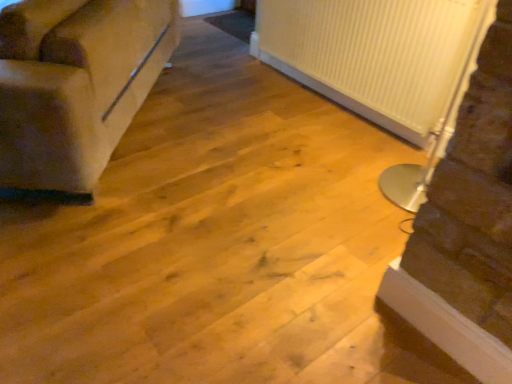
The width and height of the screenshot is (512, 384). Identify the location of white ribbed radiator at upper right. (372, 54).

This screenshot has height=384, width=512. Describe the element at coordinates (372, 54) in the screenshot. I see `white ribbed radiator at upper right` at that location.

The image size is (512, 384). I want to click on white ribbed radiator at right, so click(x=467, y=227).

Is white ribbed radiator at upper right behind suede-like beige couch at left?

Yes, white ribbed radiator at upper right is further from the camera.

Locate an element on the screen. This screenshot has height=384, width=512. radiator behind the suede-like beige couch at left is located at coordinates (372, 54).

Are white ribbed radiator at upper right and suede-like beige couch at left located far from each other?

Yes, white ribbed radiator at upper right and suede-like beige couch at left are located far from each other.

In terms of size, does white ribbed radiator at right appear bigger or smaller than white ribbed radiator at upper right?

Clearly, white ribbed radiator at right is larger in size than white ribbed radiator at upper right.

Considering the sizes of objects white ribbed radiator at right and white ribbed radiator at upper right in the image provided, who is shorter, white ribbed radiator at right or white ribbed radiator at upper right?

Standing shorter between the two is white ribbed radiator at upper right.

Would you say white ribbed radiator at right contains white ribbed radiator at upper right?

Actually, white ribbed radiator at upper right is outside white ribbed radiator at right.

Identify the location of stairwell that appears in front of the white ribbed radiator at upper right. The width and height of the screenshot is (512, 384). (467, 227).

From the image's perspective, is white ribbed radiator at right positioned above or below suede-like beige couch at left?

Clearly, from the image's perspective, white ribbed radiator at right is below suede-like beige couch at left.

Based on their positions, is white ribbed radiator at right located to the left or right of suede-like beige couch at left?

white ribbed radiator at right is positioned on suede-like beige couch at left's right side.

How different are the orientations of white ribbed radiator at right and suede-like beige couch at left in degrees?

The angular difference between white ribbed radiator at right and suede-like beige couch at left is 42.1 degrees.

In terms of size, does white ribbed radiator at right appear bigger or smaller than suede-like beige couch at left?

In the image, white ribbed radiator at right appears to be smaller than suede-like beige couch at left.

Can you confirm if suede-like beige couch at left is bigger than white ribbed radiator at right?

Correct, suede-like beige couch at left is larger in size than white ribbed radiator at right.

Is suede-like beige couch at left oriented away from white ribbed radiator at right?

Yes, white ribbed radiator at right is at the back of suede-like beige couch at left.

From the picture: From a real-world perspective, is suede-like beige couch at left physically below white ribbed radiator at right?

Yes, from a real-world perspective, suede-like beige couch at left is under white ribbed radiator at right.

In the scene shown: Does suede-like beige couch at left contain white ribbed radiator at upper right?

No, white ribbed radiator at upper right is not surrounded by suede-like beige couch at left.

Is suede-like beige couch at left next to white ribbed radiator at upper right and touching it?

No, suede-like beige couch at left is not making contact with white ribbed radiator at upper right.

Does suede-like beige couch at left have a smaller size compared to white ribbed radiator at upper right?

Actually, suede-like beige couch at left might be larger than white ribbed radiator at upper right.

Which is behind, suede-like beige couch at left or white ribbed radiator at upper right?

white ribbed radiator at upper right is behind.

You are a GUI agent. You are given a task and a screenshot of the screen. Output one action in this format:
    pyautogui.click(x=<x>, y=<y>)
    Task: Click on the radiator behind the white ribbed radiator at right
    
    Given the screenshot: What is the action you would take?
    pyautogui.click(x=372, y=54)

Does white ribbed radiator at upper right appear on the right side of white ribbed radiator at right?

Incorrect, white ribbed radiator at upper right is not on the right side of white ribbed radiator at right.

How different are the orientations of white ribbed radiator at upper right and white ribbed radiator at right in degrees?

white ribbed radiator at upper right and white ribbed radiator at right are facing 0.203 degrees away from each other.

Where is `radiator located on the right of suede-like beige couch at left`? radiator located on the right of suede-like beige couch at left is located at coordinates (372, 54).

You are a GUI agent. You are given a task and a screenshot of the screen. Output one action in this format:
    pyautogui.click(x=<x>, y=<y>)
    Task: Click on the stairwell that appears below the white ribbed radiator at upper right (from the image's perspective)
    This screenshot has height=384, width=512.
    Given the screenshot: What is the action you would take?
    pyautogui.click(x=467, y=227)

Looking at the image, which one is located further to white ribbed radiator at upper right, white ribbed radiator at right or suede-like beige couch at left?

suede-like beige couch at left lies further to white ribbed radiator at upper right than the other object.

Which object lies further to the anchor point white ribbed radiator at upper right, suede-like beige couch at left or white ribbed radiator at right?

Among the two, suede-like beige couch at left is located further to white ribbed radiator at upper right.

Considering their positions, is suede-like beige couch at left positioned further to white ribbed radiator at right than white ribbed radiator at upper right?

suede-like beige couch at left.

From the image, which object appears to be farther from suede-like beige couch at left, white ribbed radiator at upper right or white ribbed radiator at right?

white ribbed radiator at right is positioned further to the anchor suede-like beige couch at left.

From the image, which object appears to be nearer to white ribbed radiator at right, white ribbed radiator at upper right or suede-like beige couch at left?

Among the two, white ribbed radiator at upper right is located nearer to white ribbed radiator at right.

Estimate the real-world distances between objects in this image. Which object is further from suede-like beige couch at left, white ribbed radiator at right or white ribbed radiator at upper right?

white ribbed radiator at right is further to suede-like beige couch at left.

Where is `radiator between suede-like beige couch at left and white ribbed radiator at right from left to right`? radiator between suede-like beige couch at left and white ribbed radiator at right from left to right is located at coordinates (372, 54).